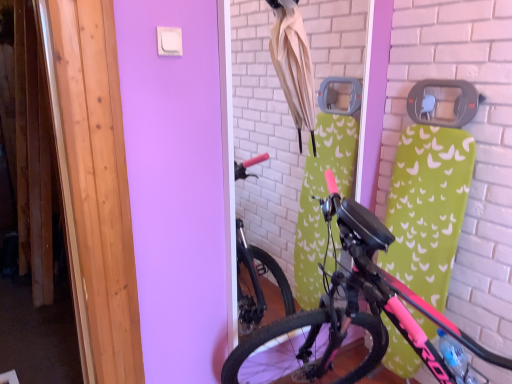
Question: Is beige fabric umbrella at upper center bigger or smaller than pink matte bicycle at center?

Choices:
 (A) big
 (B) small

Answer: (B)

Question: Considering the positions of beige fabric umbrella at upper center and pink matte bicycle at center in the image, is beige fabric umbrella at upper center taller or shorter than pink matte bicycle at center?

Choices:
 (A) short
 (B) tall

Answer: (A)

Question: Choose the correct answer: Is beige fabric umbrella at upper center inside pink matte bicycle at center or outside it?

Choices:
 (A) inside
 (B) outside

Answer: (B)

Question: Is pink matte bicycle at center inside or outside of beige fabric umbrella at upper center?

Choices:
 (A) inside
 (B) outside

Answer: (B)

Question: In terms of width, does pink matte bicycle at center look wider or thinner when compared to beige fabric umbrella at upper center?

Choices:
 (A) thin
 (B) wide

Answer: (B)

Question: From the image's perspective, is pink matte bicycle at center above or below beige fabric umbrella at upper center?

Choices:
 (A) above
 (B) below

Answer: (B)

Question: Would you say pink matte bicycle at center is to the left or to the right of beige fabric umbrella at upper center in the picture?

Choices:
 (A) right
 (B) left

Answer: (A)